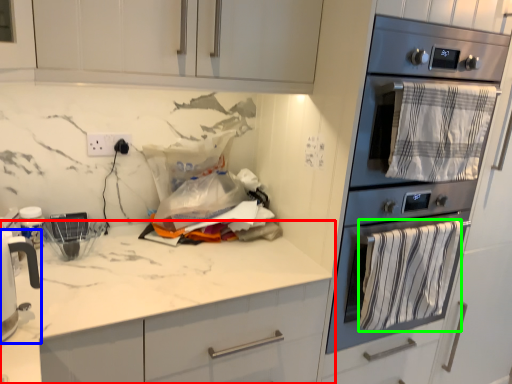
Question: Which object is the farthest from countertop (highlighted by a red box)? Choose among these: home appliance (highlighted by a blue box) or blanket (highlighted by a green box).

Choices:
 (A) home appliance
 (B) blanket

Answer: (B)